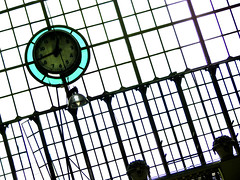
I want to click on clock numbers, so (x=67, y=38), (x=72, y=46), (x=73, y=54), (x=67, y=60), (x=60, y=66), (x=54, y=65), (x=45, y=63), (x=42, y=55), (x=41, y=49).